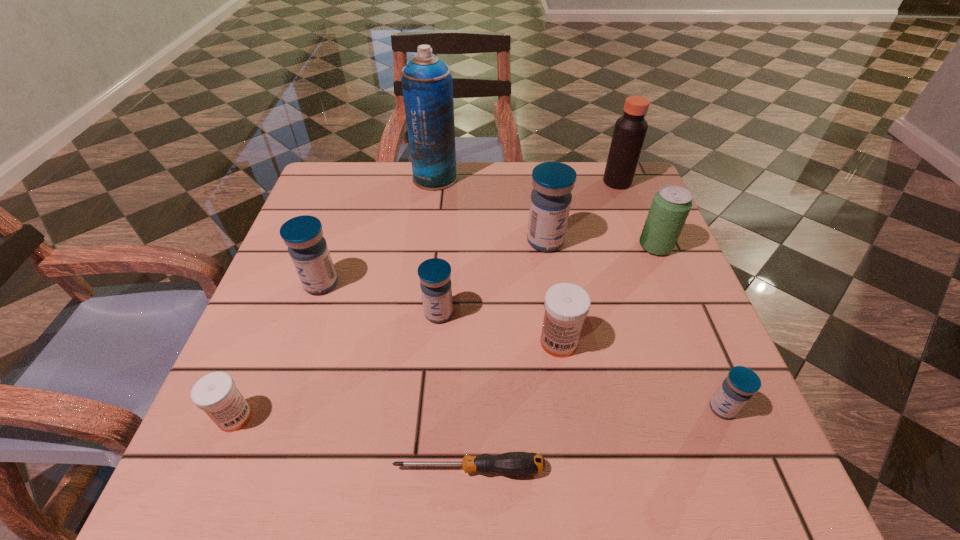
Find the location of a particular element. This screenshot has height=540, width=960. vacant space at the far left corner of the desktop is located at coordinates (368, 202).

At what (x,y) coordinates should I click in order to perform the action: click on vacant region at the far right corner of the desktop. Please return your answer as a coordinate pair (x, y). Looking at the image, I should click on (643, 188).

In the image, there is a desktop. Where is `free space at the near right corner`? free space at the near right corner is located at coordinates pos(663,472).

I want to click on free space between the ninth shortest object and the second farthest blue medicine, so click(x=469, y=233).

Find the location of a particular element. blank region between the soda and the second tallest medicine is located at coordinates (489, 265).

Find the location of a particular element. free space that is in between the tallest medicine and the shortest object is located at coordinates (507, 355).

Locate an element on the screen. blank region between the third blue medicine from right to left and the nearest object is located at coordinates pyautogui.click(x=454, y=391).

Locate an element on the screen. vacant space that is in between the smaller white medicine and the sixth nearest object is located at coordinates 278,350.

Where is `empty space between the left white medicine and the right white medicine`? empty space between the left white medicine and the right white medicine is located at coordinates (397, 380).

Find the location of a particular element. object that stands as the closest to the third biggest blue medicine is located at coordinates (566, 305).